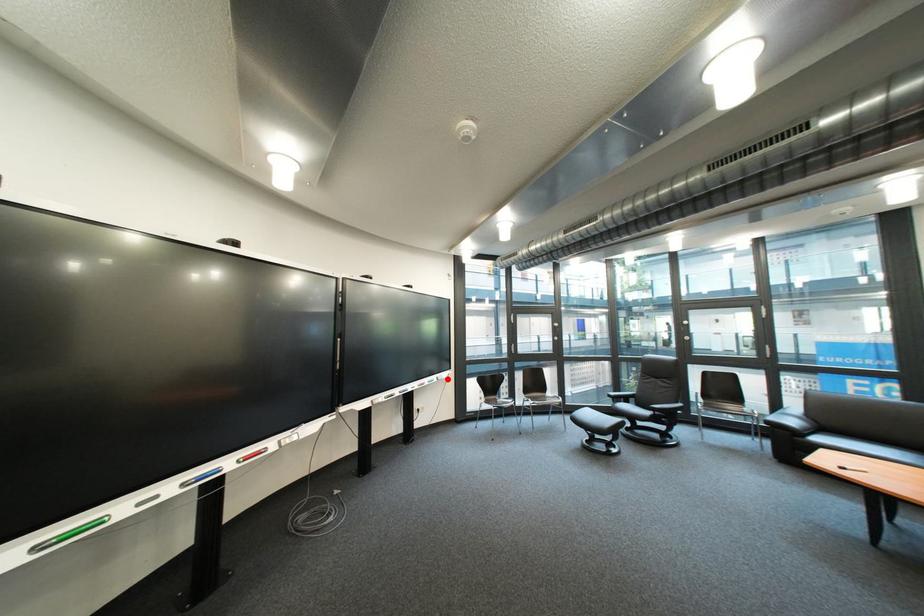
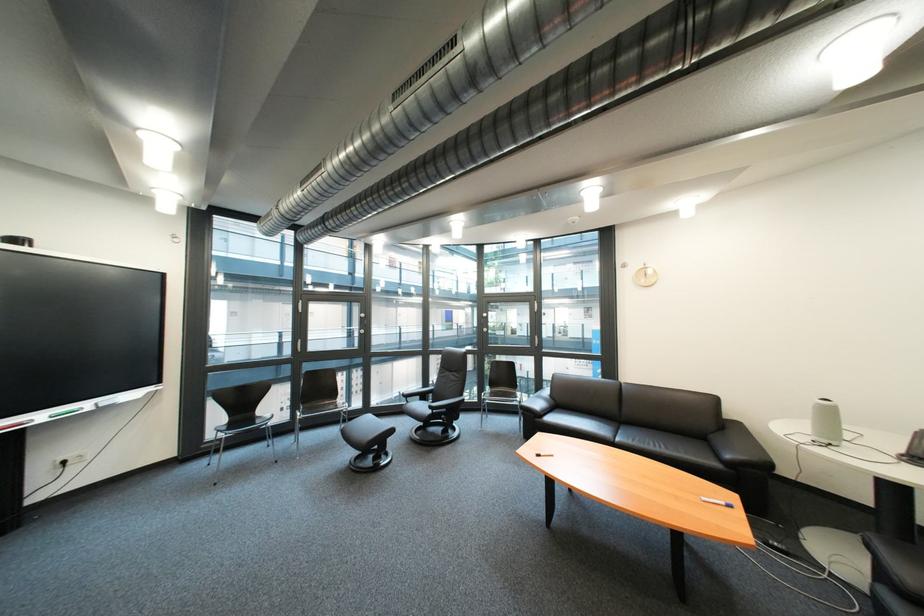
Where in the second image is the point corresponding to the highlighted location from the first image?

(101, 406)